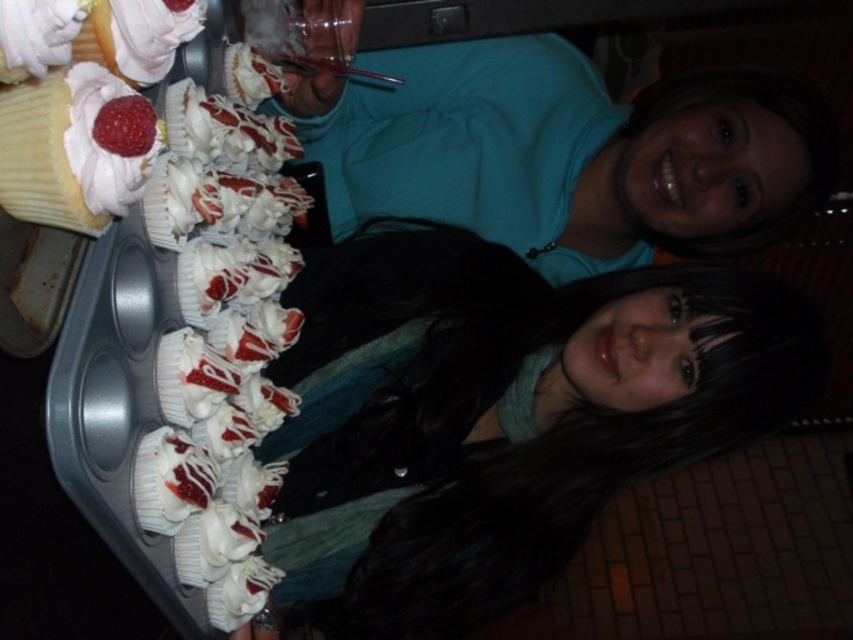
Question: Which point is farther to the camera?

Choices:
 (A) (115, 196)
 (B) (4, 19)
 (C) (392, 474)

Answer: (C)

Question: Does white glossy frosting at center appear on the right side of white glossy icing at upper left?

Choices:
 (A) no
 (B) yes

Answer: (B)

Question: Is white glossy frosting at center positioned before white glossy icing at upper left?

Choices:
 (A) no
 (B) yes

Answer: (A)

Question: Estimate the real-world distances between objects in this image. Which object is farther from the white glossy frosting at center?

Choices:
 (A) matte white cake at upper center
 (B) white glossy icing at upper left

Answer: (A)

Question: Which point is farther from the camera taking this photo?

Choices:
 (A) (138, 193)
 (B) (48, 61)
 (C) (454, 472)
 (D) (358, 58)

Answer: (D)

Question: Where is matte white cake at upper center located in relation to white glossy icing at upper left in the image?

Choices:
 (A) above
 (B) below

Answer: (A)